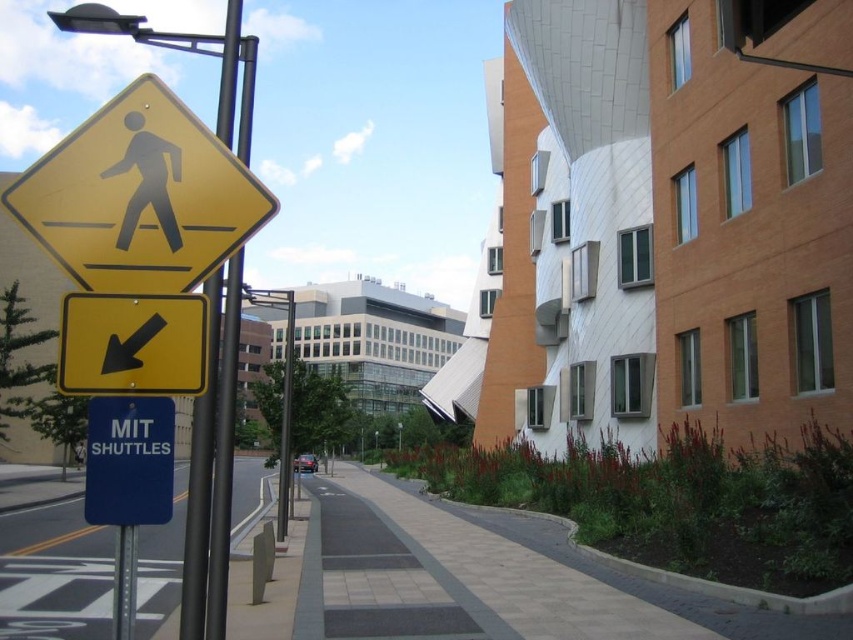
Question: Which point is farther from the camera taking this photo?

Choices:
 (A) (96, 230)
 (B) (100, 419)
 (C) (102, 323)
 (D) (227, 349)

Answer: (D)

Question: Among these points, which one is nearest to the camera?

Choices:
 (A) (165, 156)
 (B) (167, 388)

Answer: (B)

Question: Can you confirm if metallic pole at left is positioned to the right of metallic pole at lower left?

Choices:
 (A) no
 (B) yes

Answer: (A)

Question: Is yellow matte pedestrian crossing sign at upper left thinner than yellow matte arrow at lower left?

Choices:
 (A) no
 (B) yes

Answer: (A)

Question: Which point is closer to the camera?

Choices:
 (A) black plastic pedestrian sign at upper left
 (B) yellow matte arrow at lower left

Answer: (B)

Question: Can you confirm if yellow matte arrow at lower left is bigger than metallic pole at left?

Choices:
 (A) no
 (B) yes

Answer: (A)